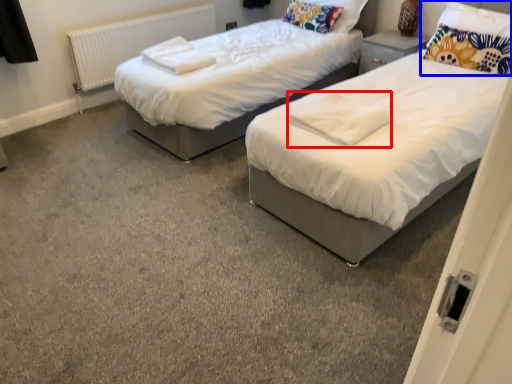
Question: Among these objects, which one is nearest to the camera, linen (highlighted by a red box) or pillow (highlighted by a blue box)?

Choices:
 (A) linen
 (B) pillow

Answer: (A)